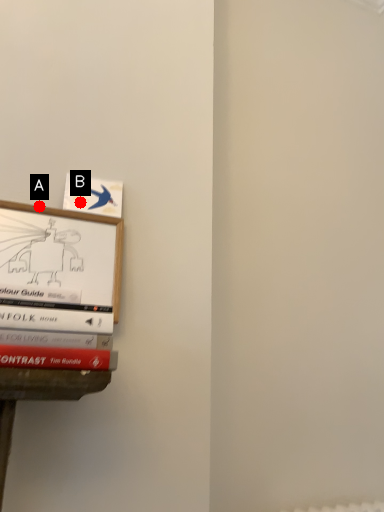
Question: Two points are circled on the image, labeled by A and B beside each circle. Among these points, which one is farthest from the camera?

Choices:
 (A) A is further
 (B) B is further

Answer: (B)